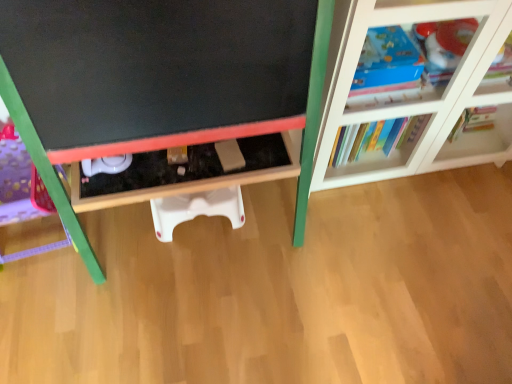
Describe the element at coordinates (407, 60) in the screenshot. This screenshot has height=384, width=512. I see `blue matte book at upper right` at that location.

Where is `blue matte book at upper right`? blue matte book at upper right is located at coordinates (407, 60).

What is the approximate width of blue matte book at upper right?

The width of blue matte book at upper right is 24.42 centimeters.

At what (x,y) coordinates should I click in order to perform the action: click on blue matte book at upper right. Please return your answer as a coordinate pair (x, y). The height and width of the screenshot is (384, 512). Looking at the image, I should click on (407, 60).